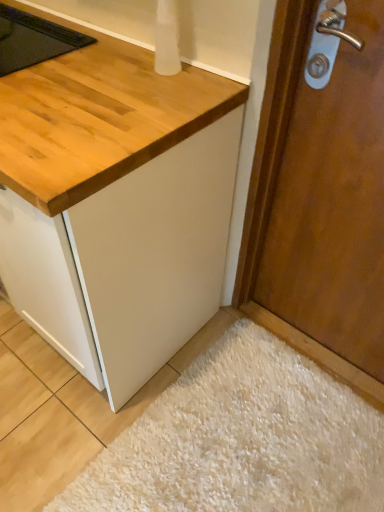
Question: Considering the relative sizes of white shaggy rug at lower right and wooden door at right in the image provided, is white shaggy rug at lower right shorter than wooden door at right?

Choices:
 (A) yes
 (B) no

Answer: (A)

Question: Could you tell me if white shaggy rug at lower right is facing wooden door at right?

Choices:
 (A) no
 (B) yes

Answer: (A)

Question: Would you say white shaggy rug at lower right is outside wooden door at right?

Choices:
 (A) yes
 (B) no

Answer: (A)

Question: Is white shaggy rug at lower right closer to camera compared to wooden door at right?

Choices:
 (A) yes
 (B) no

Answer: (B)

Question: Is white shaggy rug at lower right to the right of wooden door at right from the viewer's perspective?

Choices:
 (A) no
 (B) yes

Answer: (A)

Question: From a real-world perspective, is white shaggy rug at lower right on wooden door at right?

Choices:
 (A) no
 (B) yes

Answer: (A)

Question: Does wooden door at right have a greater width compared to white shaggy rug at lower right?

Choices:
 (A) yes
 (B) no

Answer: (B)

Question: Does wooden door at right have a smaller size compared to white shaggy rug at lower right?

Choices:
 (A) yes
 (B) no

Answer: (B)

Question: Is wooden door at right thinner than white shaggy rug at lower right?

Choices:
 (A) yes
 (B) no

Answer: (A)

Question: Is wooden door at right surrounding white shaggy rug at lower right?

Choices:
 (A) no
 (B) yes

Answer: (A)

Question: Does wooden door at right touch white shaggy rug at lower right?

Choices:
 (A) no
 (B) yes

Answer: (A)

Question: Considering the relative sizes of wooden door at right and white shaggy rug at lower right in the image provided, is wooden door at right taller than white shaggy rug at lower right?

Choices:
 (A) no
 (B) yes

Answer: (B)

Question: Is point (150, 490) positioned closer to the camera than point (324, 253)?

Choices:
 (A) closer
 (B) farther

Answer: (A)